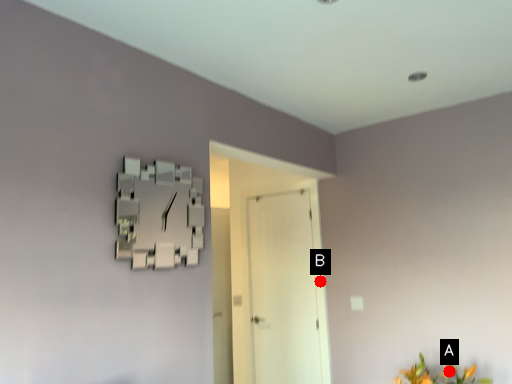
Question: Two points are circled on the image, labeled by A and B beside each circle. Which point is closer to the camera?

Choices:
 (A) A is closer
 (B) B is closer

Answer: (A)